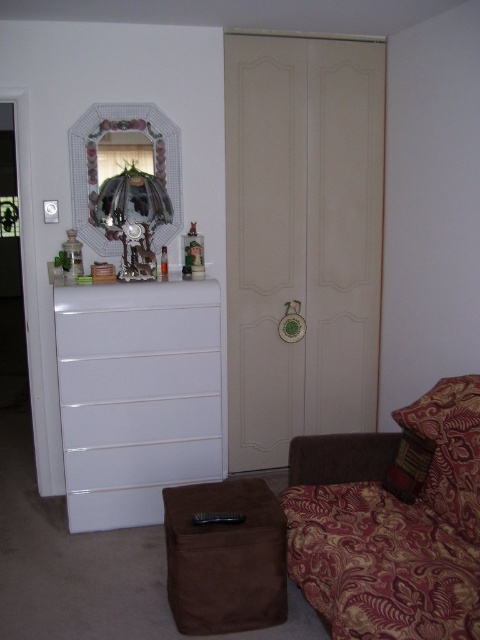
You are moving a 4.5 feet wide sofa into the room. You need to place it between the beige matte door at center and the brown suede stool at lower center. Is there enough space for the sofa?

The beige matte door at center and brown suede stool at lower center are 4.49 feet apart from each other. Since the sofa is 4.5 feet wide, there is not enough space to fit it between them.

In the scene shown: You are a delivery person trying to place a rectangular package that is 20 centimeters long. You need to place it between the patterned fabric couch at lower right and the patterned fabric pillow at lower right. Will it fit?

The distance between the patterned fabric couch at lower right and the patterned fabric pillow at lower right is 19.95 centimeters. Since the package is 20 centimeters long, it will not fit as the space is slightly smaller than the package.

You are organizing a space and need to place a new shelf above the white glossy dresser at left. Based on the current arrangement, can the decorative glass mirror at upper left be moved to make space for the shelf?

The white glossy dresser at left is positioned under the decorative glass mirror at upper left, so the mirror is already above the dresser. To place a new shelf above the dresser, the mirror would need to be moved first.